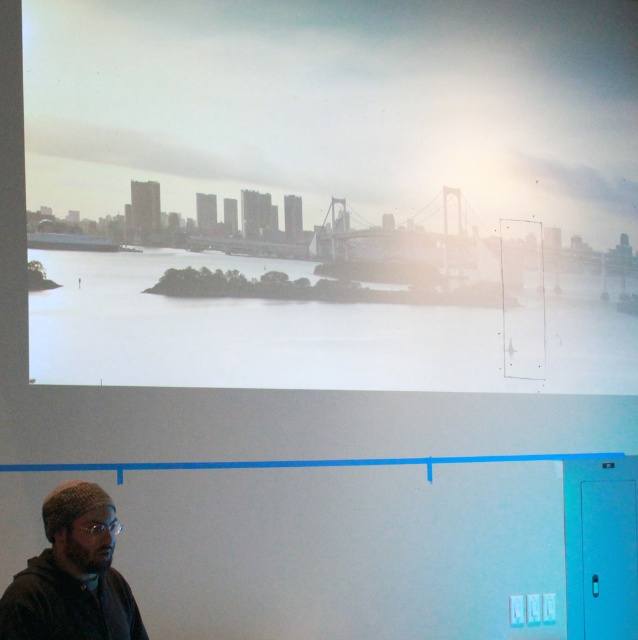
Who is higher up, matte white cityscape at upper center or knitted wool hat at lower left?

Positioned higher is matte white cityscape at upper center.

Identify the location of matte white cityscape at upper center. (338, 189).

Find the location of a particular element. This screenshot has height=640, width=638. matte white cityscape at upper center is located at coordinates (338, 189).